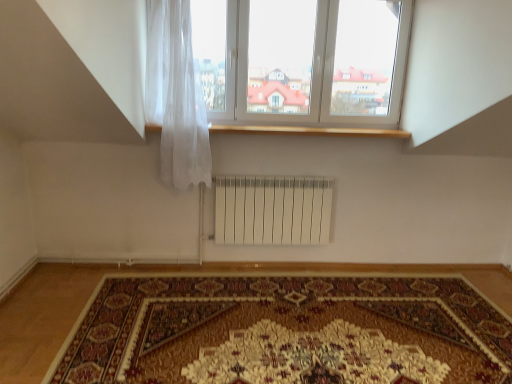
Question: Is white plastic window at upper center situated inside translucent white curtain at upper left or outside?

Choices:
 (A) outside
 (B) inside

Answer: (A)

Question: From the image's perspective, is white plastic window at upper center positioned above or below translucent white curtain at upper left?

Choices:
 (A) above
 (B) below

Answer: (A)

Question: Based on their relative distances, which object is farther from the wooden at upper center?

Choices:
 (A) translucent white curtain at upper left
 (B) white plastic window at upper center
 (C) carpeted rug at center

Answer: (C)

Question: Which object is positioned closest to the translucent white curtain at upper left?

Choices:
 (A) wooden at upper center
 (B) carpeted rug at center
 (C) white plastic window at upper center

Answer: (A)